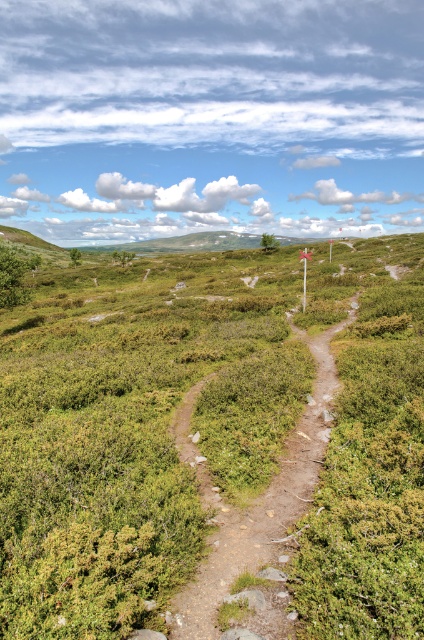
You are a hiker standing on the narrow dirt path in the foreground of the scene. You want to reach the scattered trees in the midground. Which direction should you walk to avoid the green leafy shrubs at center?

To avoid the green leafy shrubs at center located at point (133, 433), you should walk towards the right side of the path since the shrubs are centered and the path winds around them.